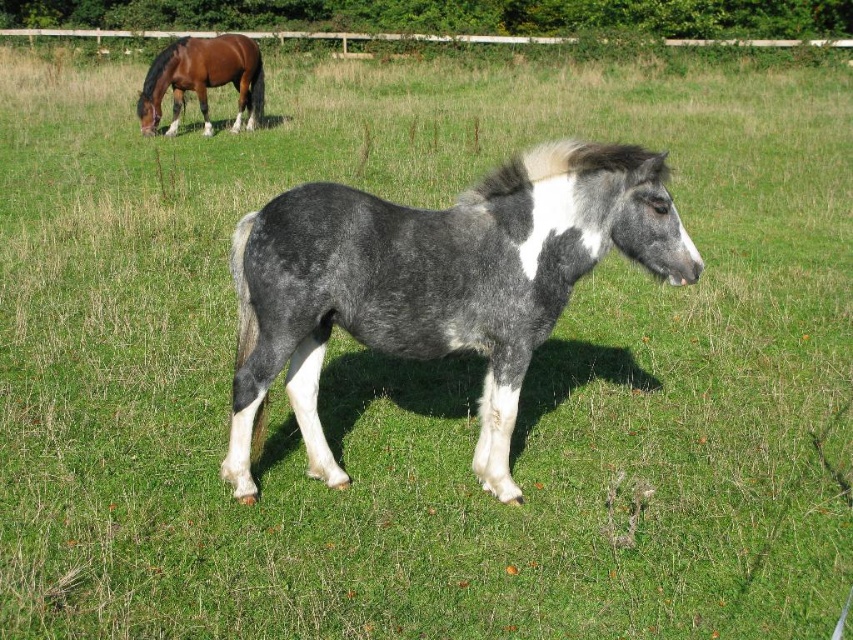
Question: Which object is positioned farthest from the brown glossy horse at upper left?

Choices:
 (A) gray speckled coat at center
 (B) gray woolen tail at lower center

Answer: (B)

Question: Is gray speckled coat at center to the left of gray woolen tail at lower center from the viewer's perspective?

Choices:
 (A) yes
 (B) no

Answer: (B)

Question: Is gray speckled coat at center to the left of gray woolen tail at lower center from the viewer's perspective?

Choices:
 (A) no
 (B) yes

Answer: (A)

Question: Does gray speckled coat at center have a greater width compared to brown glossy horse at upper left?

Choices:
 (A) yes
 (B) no

Answer: (A)

Question: Which point is farther to the camera?

Choices:
 (A) gray speckled coat at center
 (B) brown glossy horse at upper left

Answer: (B)

Question: Among these points, which one is nearest to the camera?

Choices:
 (A) (233, 278)
 (B) (169, 67)

Answer: (A)